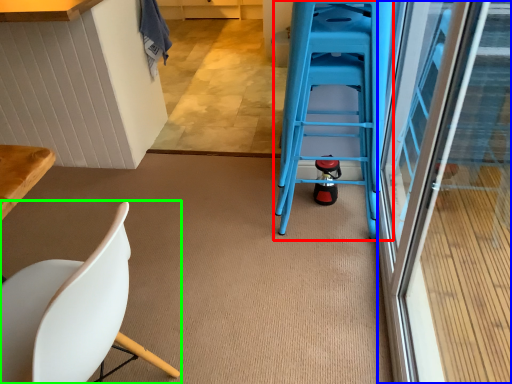
Question: Which is farther away from ladder (highlighted by a red box)? screen door (highlighted by a blue box) or chair (highlighted by a green box)?

Choices:
 (A) screen door
 (B) chair

Answer: (B)